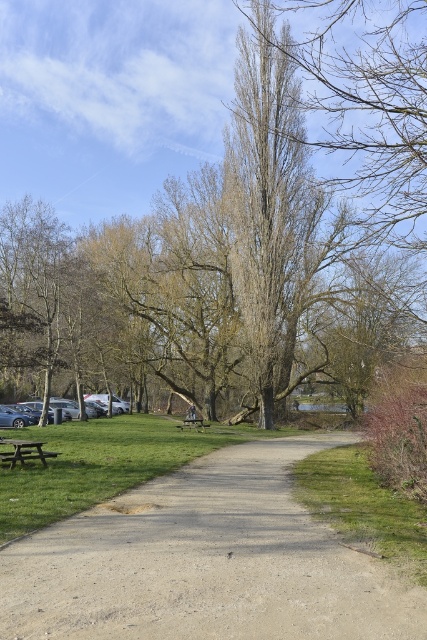
Question: Which object appears farthest from the camera in this image?

Choices:
 (A) dirt/gravel path at center
 (B) brown wooden picnic table at lower left
 (C) brown textured tree at center
 (D) wooden park bench at center

Answer: (D)

Question: Can you confirm if silver metallic car at lower left is bigger than wooden park bench at center?

Choices:
 (A) no
 (B) yes

Answer: (B)

Question: Which of the following is the closest to the observer?

Choices:
 (A) silver metallic car at lower left
 (B) brown wooden picnic table at lower left
 (C) brown textured tree at center

Answer: (C)

Question: Can you confirm if green grass at lower right is bigger than silver metallic car at lower left?

Choices:
 (A) no
 (B) yes

Answer: (A)

Question: Which point appears closest to the camera in this image?

Choices:
 (A) (104, 403)
 (B) (376, 540)
 (C) (49, 456)

Answer: (B)

Question: Does brown textured tree at center have a lesser width compared to green grass at lower right?

Choices:
 (A) no
 (B) yes

Answer: (A)